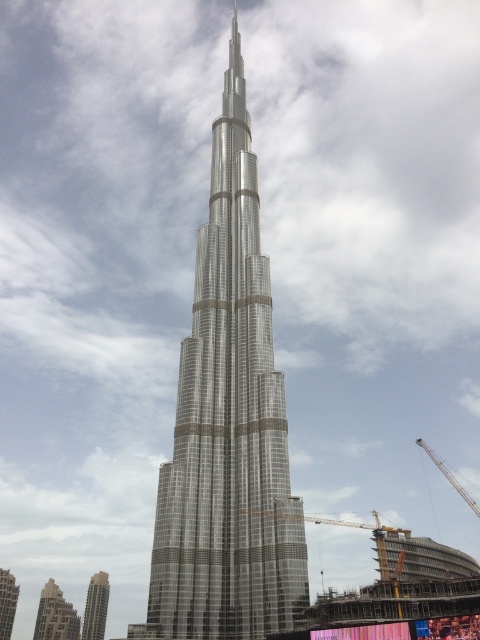
Question: Is metallic yellow crane at lower center below metallic silver crane at right?

Choices:
 (A) yes
 (B) no

Answer: (B)

Question: Which point appears closest to the camera in this image?

Choices:
 (A) (406, 536)
 (B) (467, 493)
 (C) (98, 605)

Answer: (A)

Question: Can you confirm if silver metallic skyscraper at center is positioned to the left of metallic silver crane at right?

Choices:
 (A) yes
 (B) no

Answer: (A)

Question: Which of the following is the farthest from the observer?

Choices:
 (A) (422, 444)
 (B) (260, 310)
 (C) (11, 628)
 (D) (88, 598)

Answer: (A)

Question: Observing the image, what is the correct spatial positioning of silver metallic skyscraper at center in reference to metallic silver crane at right?

Choices:
 (A) above
 (B) below

Answer: (B)

Question: Which point is closer to the camera?

Choices:
 (A) metallic silver crane at right
 (B) silver glass skyscraper at lower left
 (C) metallic yellow crane at lower center

Answer: (C)